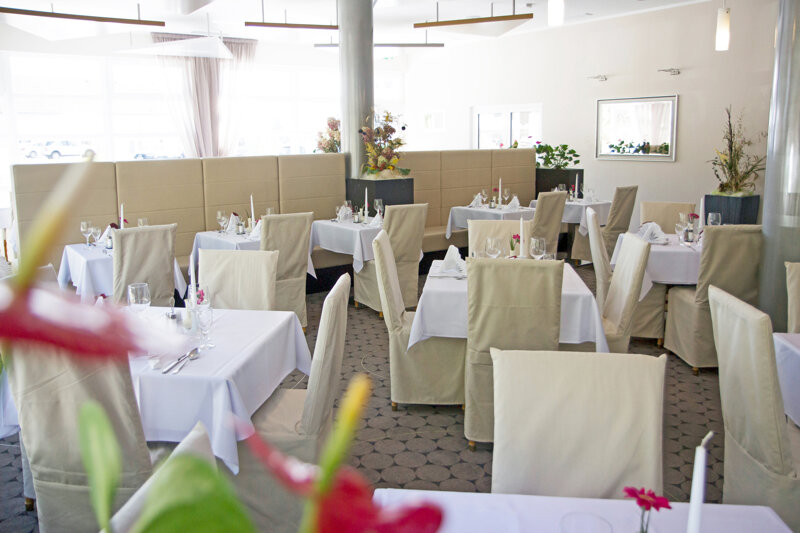
Find the location of a particular element. white table cloths is located at coordinates (242, 339), (93, 263), (238, 236), (338, 233), (444, 292), (666, 265), (784, 345), (584, 207), (506, 211), (494, 502).